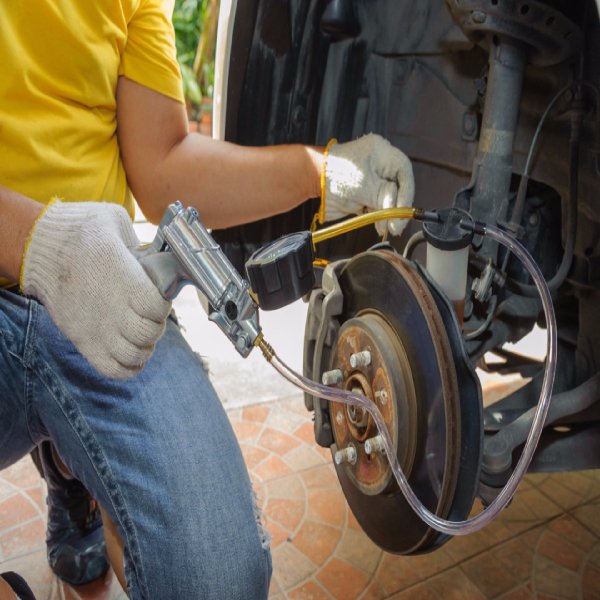
At what (x,y) coordinates should I click in order to perform the action: click on tiles. Please return your answer as a coordinate pair (x, y). This screenshot has height=600, width=600. Looking at the image, I should click on (309, 550).